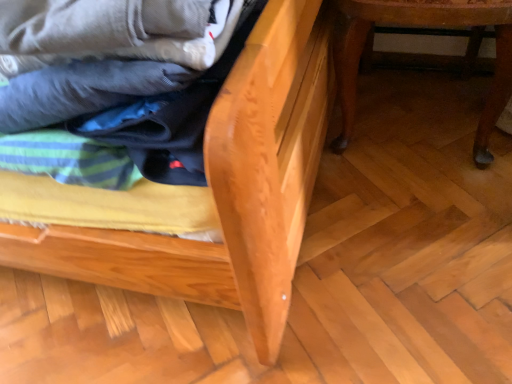
Question: Considering the positions of wooden table at lower right, arranged as the 1th furniture when viewed from the right, and matte cotton laundry at center in the image, is wooden table at lower right, arranged as the 1th furniture when viewed from the right, bigger or smaller than matte cotton laundry at center?

Choices:
 (A) small
 (B) big

Answer: (B)

Question: From the image's perspective, is wooden table at lower right, which ranks as the second furniture in left-to-right order, positioned above or below matte cotton laundry at center?

Choices:
 (A) below
 (B) above

Answer: (B)

Question: Which is nearer to the natural wood bed frame at center, positioned as the 1th furniture in left-to-right order?

Choices:
 (A) wooden table at lower right, arranged as the 1th furniture when viewed from the right
 (B) matte cotton laundry at center

Answer: (B)

Question: Which of these objects is positioned closest to the matte cotton laundry at center?

Choices:
 (A) wooden table at lower right, which ranks as the second furniture in left-to-right order
 (B) natural wood bed frame at center, positioned as the 1th furniture in left-to-right order

Answer: (B)